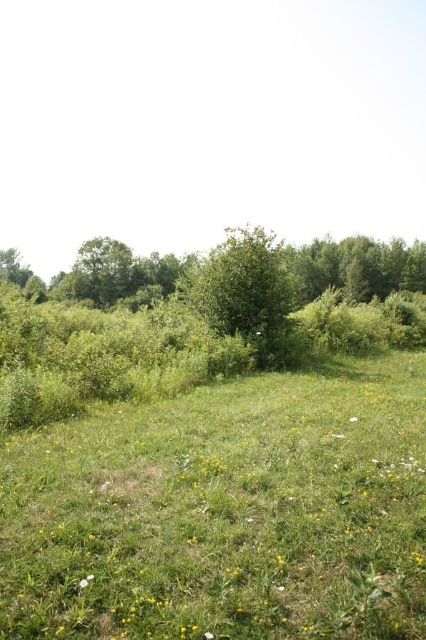
Question: Which point is farther to the camera?

Choices:
 (A) green grass at center
 (B) green leafy tree at center
 (C) green leafy tree at left

Answer: (C)

Question: Is green grass at center to the left of green leafy tree at left from the viewer's perspective?

Choices:
 (A) yes
 (B) no

Answer: (B)

Question: Is green leafy tree at center bigger than green leafy tree at left?

Choices:
 (A) no
 (B) yes

Answer: (B)

Question: Based on their relative distances, which object is nearer to the green grass at center?

Choices:
 (A) green leafy tree at center
 (B) green leafy tree at left

Answer: (A)

Question: Which object appears farthest from the camera in this image?

Choices:
 (A) green leafy tree at center
 (B) green leafy tree at left
 (C) green grass at center

Answer: (B)

Question: Observing the image, what is the correct spatial positioning of green grass at center in reference to green leafy tree at center?

Choices:
 (A) left
 (B) right

Answer: (B)